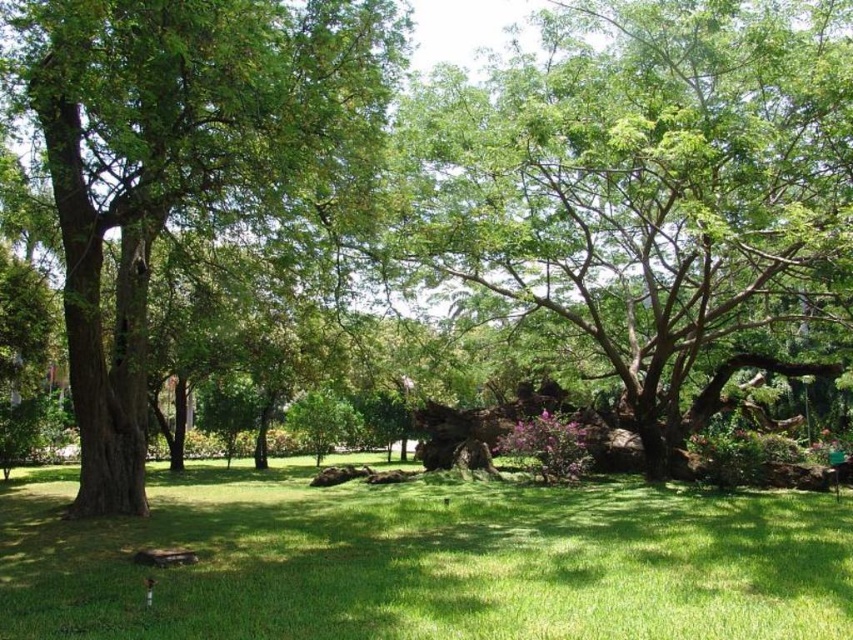
Question: Among these objects, which one is nearest to the camera?

Choices:
 (A) green leafy tree at center
 (B) green leafy tree at left

Answer: (B)

Question: Is green leafy tree at center wider than green leafy tree at left?

Choices:
 (A) no
 (B) yes

Answer: (B)

Question: Can you confirm if green leafy tree at center is positioned below green grassy at center?

Choices:
 (A) no
 (B) yes

Answer: (A)

Question: Estimate the real-world distances between objects in this image. Which object is farther from the green grassy at center?

Choices:
 (A) green leafy tree at left
 (B) green leafy tree at center

Answer: (A)

Question: Is green grassy at center smaller than green leafy tree at left?

Choices:
 (A) yes
 (B) no

Answer: (B)

Question: Which object is farther from the camera taking this photo?

Choices:
 (A) green leafy tree at center
 (B) green leafy tree at left

Answer: (A)